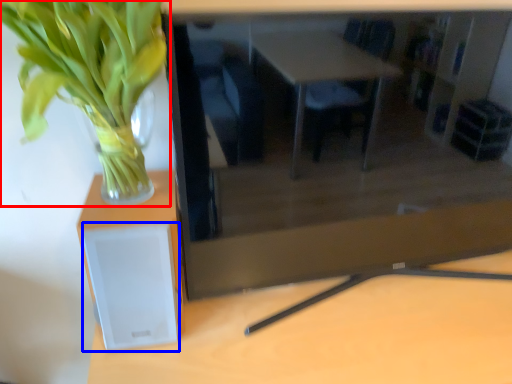
Question: Which object appears farthest to the camera in this image, houseplant (highlighted by a red box) or speaker (highlighted by a blue box)?

Choices:
 (A) houseplant
 (B) speaker

Answer: (B)